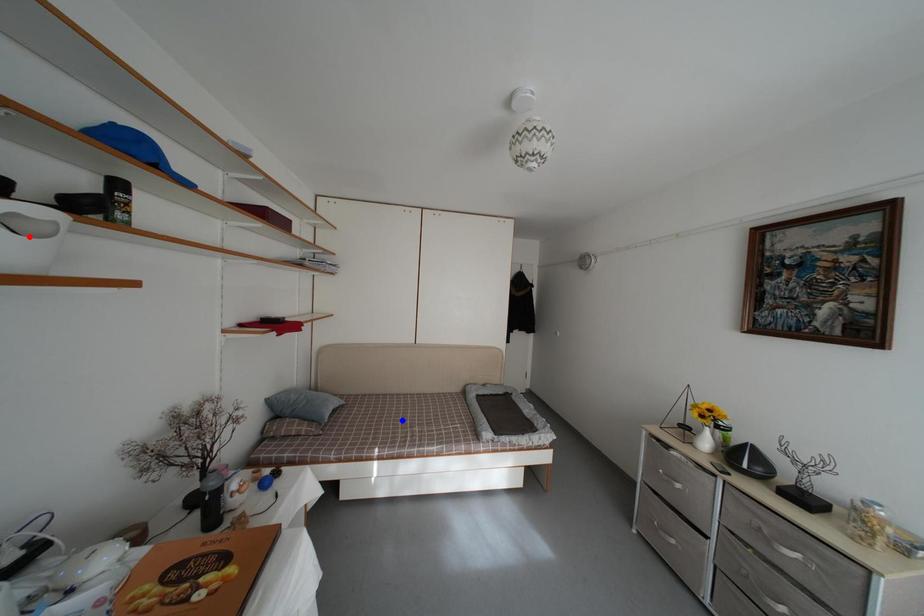
Question: In the image, two points are highlighted. Which point is nearer to the camera? Reply with the corresponding letter.

Choices:
 (A) blue point
 (B) red point

Answer: (B)